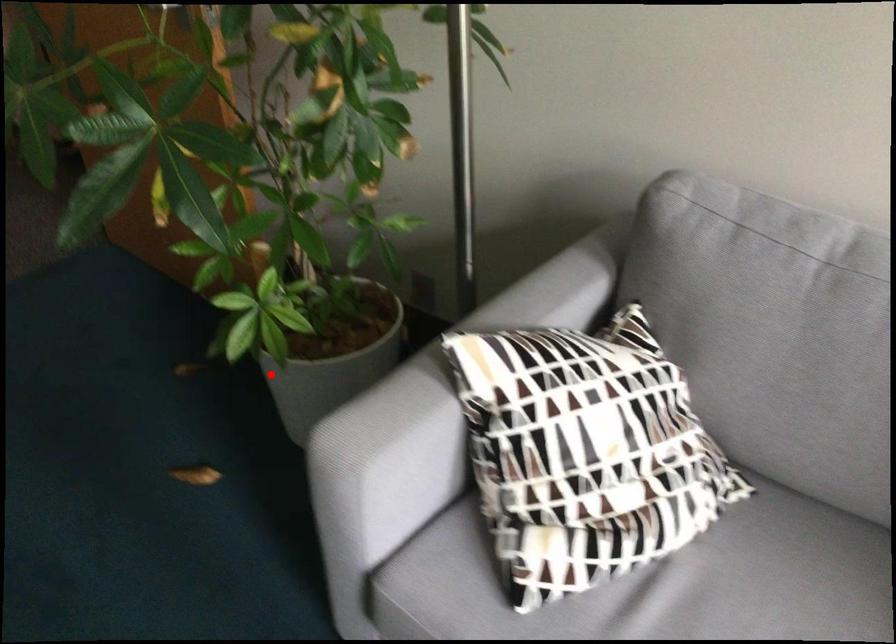
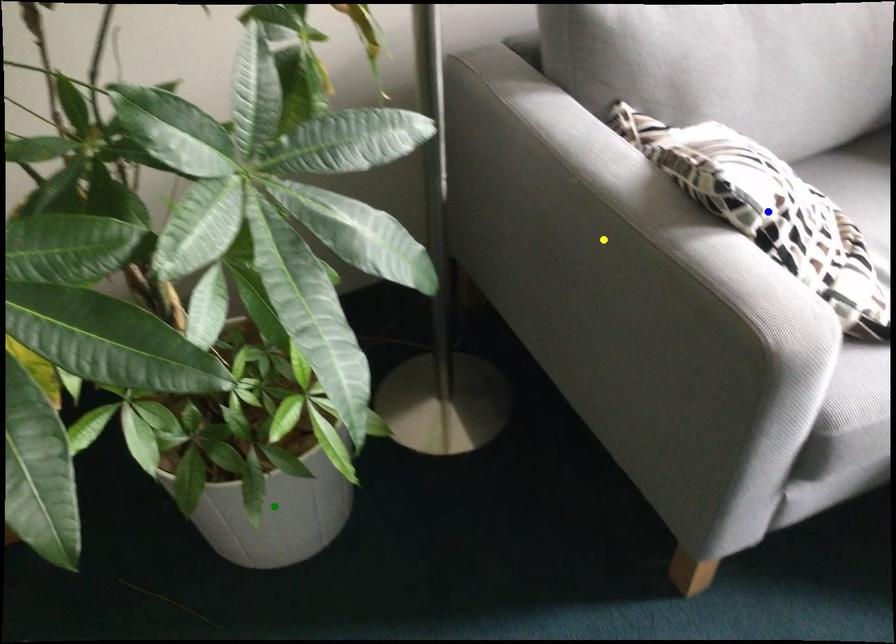
Question: I am providing you with two images of the same scene from different viewpoints. A red point is marked on the first image. You are given multiple points on the second image. Which point in image 2 is actually the same real-world point as the red point in image 1?

Choices:
 (A) blue point
 (B) green point
 (C) yellow point

Answer: (B)